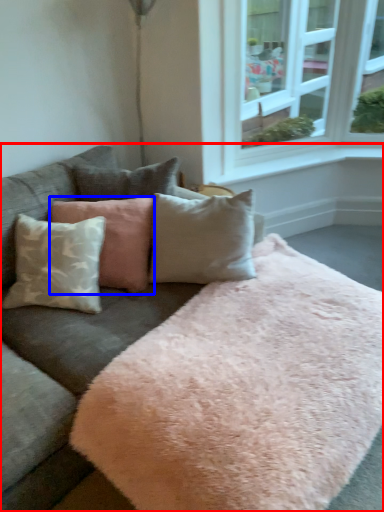
Question: Which point is further to the camera, studio couch (highlighted by a red box) or pillow (highlighted by a blue box)?

Choices:
 (A) studio couch
 (B) pillow

Answer: (B)